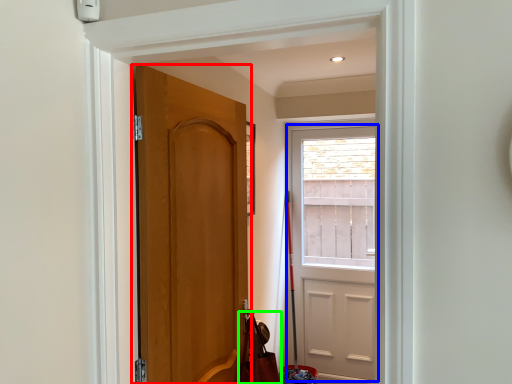
Question: Estimate the real-world distances between objects in this image. Which object is closer to door (highlighted by a red box), door (highlighted by a blue box) or shoulder bag (highlighted by a green box)?

Choices:
 (A) door
 (B) shoulder bag

Answer: (B)